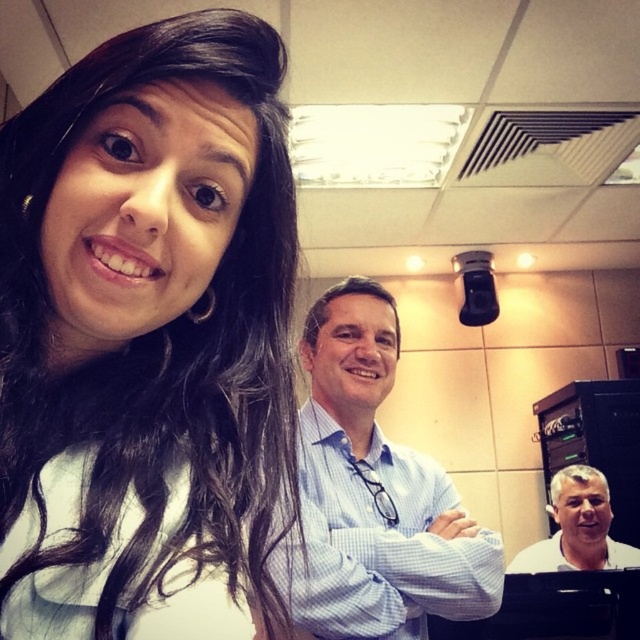
You are a photographer setting up for a group photo in the conference room. You need to position two subjects wearing the light blue checkered shirt at center and the white shirt at center. According to the scene, which shirt should be placed to the right to maintain the original composition?

The light blue checkered shirt at center should be placed to the left of the white shirt at center to maintain the original composition as described.

You are organizing a photo shoot and need to ensure that the two shirts in the image are correctly sized for the models. Given that the matte white shirt at upper left and the white shirt at center are both part of the shoot, which shirt should be paired with a smaller model?

The matte white shirt at upper left is smaller in size compared to the white shirt at center, so it should be paired with a smaller model.